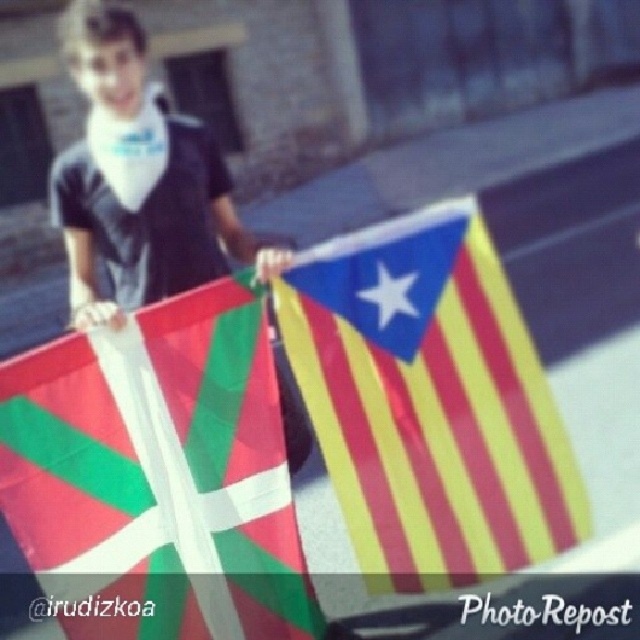
You are a photographer trying to capture both flags in a single shot. Given that the camera you are using has a minimum focusing distance of 5 feet, can you ensure both the polyester flag at center and the other flag are in focus?

The polyester flag at center and the other flag are 6.37 feet apart. Since the minimum focusing distance is 5 feet, both flags will be within the camera range and thus in focus.

From the picture: You are a photographer adjusting the lighting for a photo shoot. You notice two flags in the scene, the polyester flag at center and the yellow striped fabric at center. Which flag is casting a shadow on the other?

The polyester flag at center is positioned under the yellow striped fabric at center, so the yellow striped fabric at center is casting a shadow on the polyester flag at center.